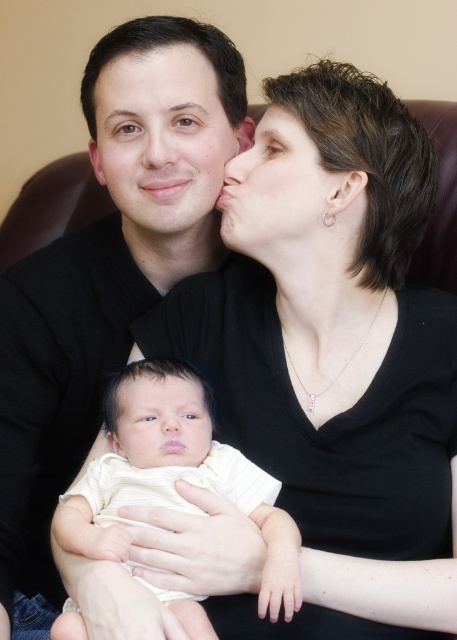
Who is higher up, yellow striped fabric baby at center or matte black hair at center?

matte black hair at center

How much distance is there between yellow striped fabric baby at center and matte black hair at center?

yellow striped fabric baby at center and matte black hair at center are 12.68 inches apart from each other.

Measure the distance between yellow striped fabric baby at center and camera.

yellow striped fabric baby at center is 26.28 inches from camera.

This screenshot has width=457, height=640. What are the coordinates of `yellow striped fabric baby at center` in the screenshot? It's located at (173, 476).

Which is more to the left, matte black shirt at center or matte skin forehead at upper center?

Positioned to the left is matte black shirt at center.

Is point (191, 68) positioned after point (138, 109)?

Yes, it is.

You are a GUI agent. You are given a task and a screenshot of the screen. Output one action in this format:
    pyautogui.click(x=<x>, y=<y>)
    Task: Click on the matte black shirt at center
    The width and height of the screenshot is (457, 640).
    Given the screenshot: What is the action you would take?
    pyautogui.click(x=109, y=268)

Is matte black shirt at center positioned at the back of matte black hair at center?

No, it is in front of matte black hair at center.

Can you confirm if matte black shirt at center is smaller than matte black hair at center?

Actually, matte black shirt at center might be larger than matte black hair at center.

Locate an element on the screen. This screenshot has width=457, height=640. matte black shirt at center is located at coordinates (109, 268).